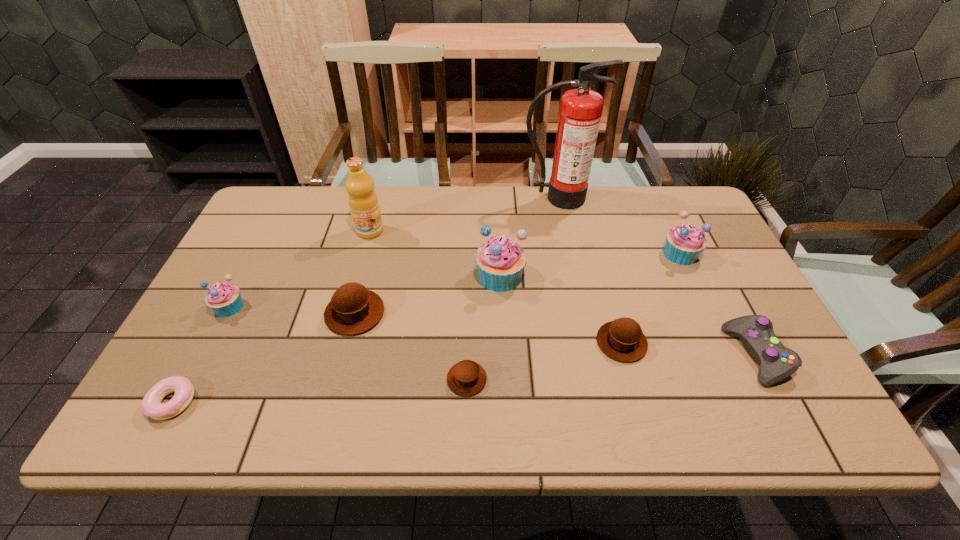
Image resolution: width=960 pixels, height=540 pixels. I want to click on vacant area between the leftmost blue muffin and the gray control, so click(492, 331).

Identify the location of free space between the eighth shortest object and the fifth muffin from right to left. (427, 295).

You are a GUI agent. You are given a task and a screenshot of the screen. Output one action in this format:
    pyautogui.click(x=<x>, y=<y>)
    Task: Click on the empty location between the gray control and the tallest object
    The image size is (960, 540).
    Given the screenshot: What is the action you would take?
    pyautogui.click(x=657, y=276)

What are the coordinates of `free area in between the second blue muffin from right to left and the red fire extinguisher` in the screenshot? It's located at (528, 237).

Identify the location of object that ranks as the seventh closest to the leftmost brown muffin. This screenshot has height=540, width=960. (623, 340).

Where is `object that stands as the closest to the gray control`? This screenshot has height=540, width=960. object that stands as the closest to the gray control is located at coordinates (623, 340).

What are the coordinates of `muffin that can be found as the fourth closest to the fifth muffin from left to right` in the screenshot? It's located at (353, 309).

Image resolution: width=960 pixels, height=540 pixels. Identify the location of muffin that is the second closest to the second muffin from right to left. (684, 243).

Identify which blue muffin is the nearest to the rightmost muffin. Please provide its 2D coordinates. Your answer should be formatted as a tuple, i.e. [(x, y)], where the tuple contains the x and y coordinates of a point satisfying the conditions above.

[(500, 261)]

Identify which blue muffin is the second nearest to the second brown muffin from left to right. Please provide its 2D coordinates. Your answer should be formatted as a tuple, i.e. [(x, y)], where the tuple contains the x and y coordinates of a point satisfying the conditions above.

[(225, 300)]